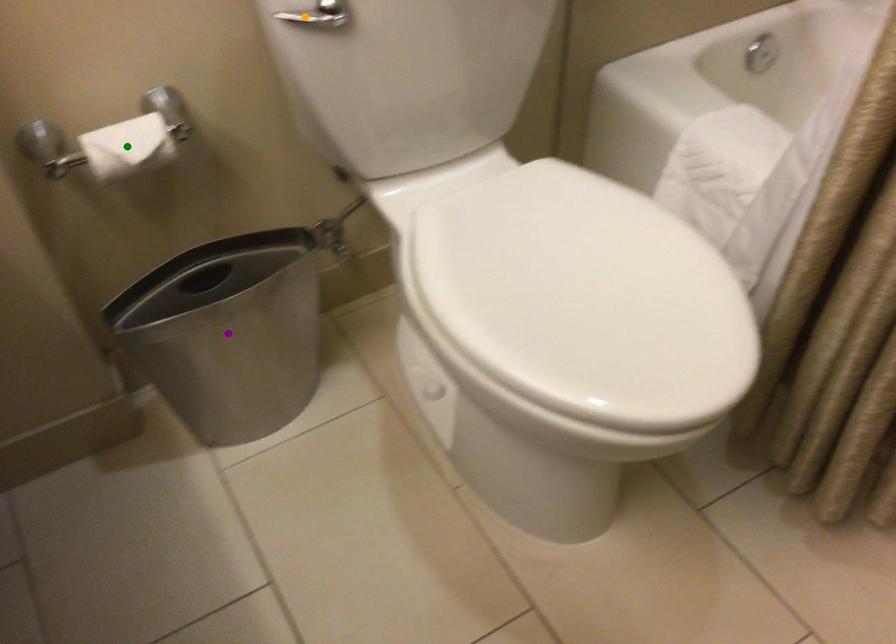
Order these from nearest to farthest:
purple point, green point, orange point

orange point, green point, purple point